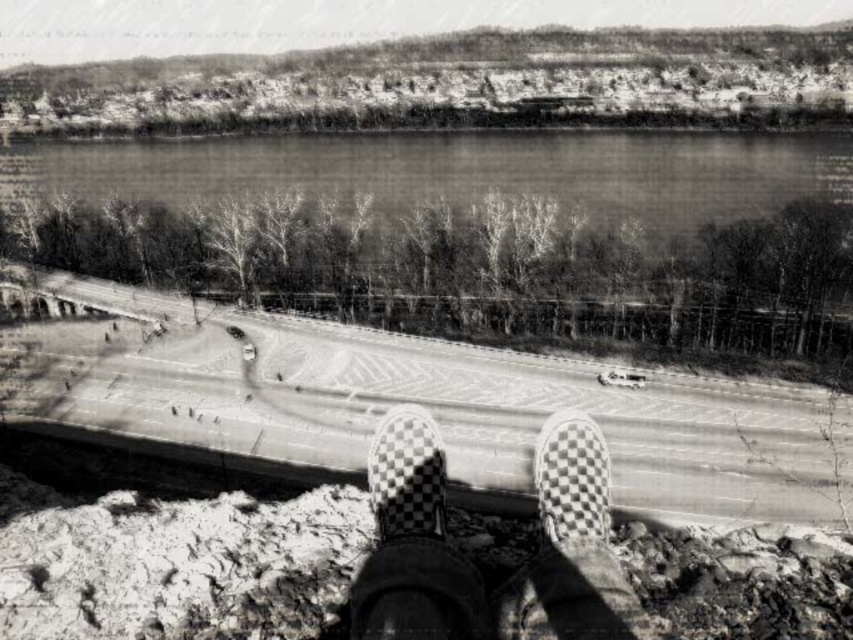
You are standing at the point marked by the coordinates point (471,564). Looking down, you see the checkerboard patterned shoes at center. What is directly below your feet?

The checkerboard patterned shoes at center are directly below the point (471,564).